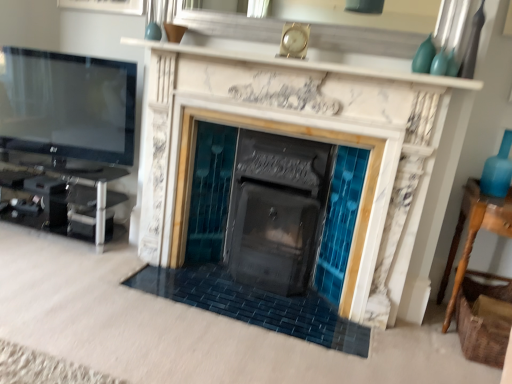
Question: Is marble fireplace at center a part of turquoise glass vase at upper right, which is the first turquoise from front to back?

Choices:
 (A) yes
 (B) no

Answer: (B)

Question: Is turquoise glass vase at upper right, which is the first turquoise from front to back, located outside marble fireplace at center?

Choices:
 (A) no
 (B) yes

Answer: (B)

Question: Does turquoise glass vase at upper right, which is the second turquoise in back-to-front order, appear on the right side of marble fireplace at center?

Choices:
 (A) no
 (B) yes

Answer: (B)

Question: Is turquoise glass vase at upper right, which is the first turquoise from front to back, facing away from marble fireplace at center?

Choices:
 (A) yes
 (B) no

Answer: (B)

Question: Is turquoise glass vase at upper right, which is the second turquoise in back-to-front order, not close to marble fireplace at center?

Choices:
 (A) no
 (B) yes

Answer: (B)

Question: Considering their positions, is wooden table at right located in front of or behind black glossy entertainment center at left?

Choices:
 (A) behind
 (B) front

Answer: (B)

Question: Considering the positions of wooden table at right and black glossy entertainment center at left in the image, is wooden table at right wider or thinner than black glossy entertainment center at left?

Choices:
 (A) wide
 (B) thin

Answer: (B)

Question: In the image, is wooden table at right on the left side or the right side of black glossy entertainment center at left?

Choices:
 (A) left
 (B) right

Answer: (B)

Question: In terms of height, does wooden table at right look taller or shorter compared to black glossy entertainment center at left?

Choices:
 (A) short
 (B) tall

Answer: (B)

Question: From a real-world perspective, is wooden table at right positioned above or below matte glass vase at upper right, which is the 1th turquoise in back-to-front order?

Choices:
 (A) below
 (B) above

Answer: (A)

Question: Is wooden table at right to the left or to the right of matte glass vase at upper right, which is the 1th turquoise in back-to-front order, in the image?

Choices:
 (A) left
 (B) right

Answer: (B)

Question: From the image's perspective, is wooden table at right above or below matte glass vase at upper right, positioned as the 2th turquoise in front-to-back order?

Choices:
 (A) above
 (B) below

Answer: (B)

Question: In the image, is wooden table at right positioned in front of or behind matte glass vase at upper right, which is the 1th turquoise in back-to-front order?

Choices:
 (A) behind
 (B) front

Answer: (B)

Question: From a real-world perspective, relative to matte glass vase at upper right, which is the 1th turquoise in back-to-front order, is turquoise glass vase at upper right, which is the second turquoise in back-to-front order, vertically above or below?

Choices:
 (A) below
 (B) above

Answer: (A)

Question: Based on their sizes in the image, would you say turquoise glass vase at upper right, which is the second turquoise in back-to-front order, is bigger or smaller than matte glass vase at upper right, which is the 1th turquoise in back-to-front order?

Choices:
 (A) big
 (B) small

Answer: (B)